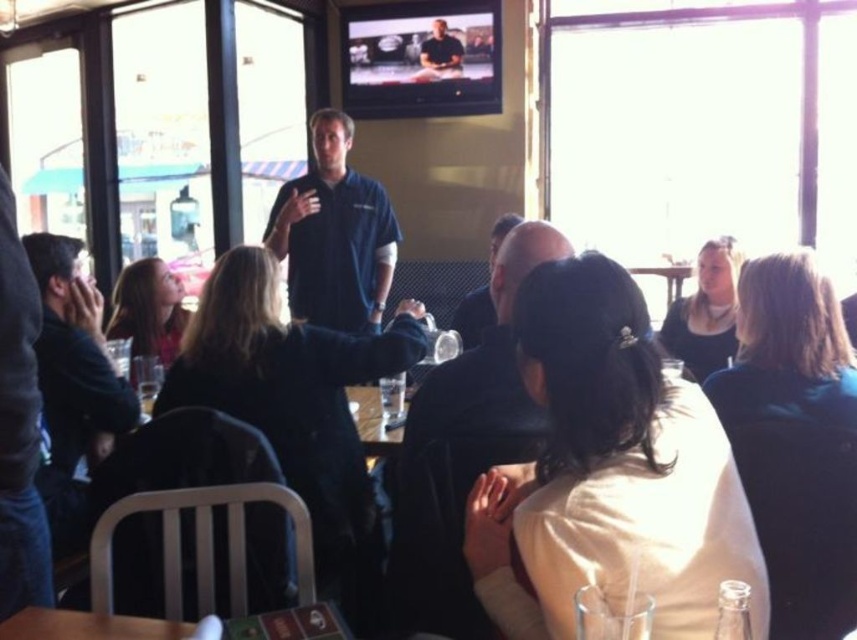
Who is more forward, (544, 616) or (379, 240)?

Point (544, 616)

Can you confirm if white matte shirt at center is shorter than dark blue polo shirt at center?

Indeed, white matte shirt at center has a lesser height compared to dark blue polo shirt at center.

Image resolution: width=857 pixels, height=640 pixels. Describe the element at coordinates (610, 472) in the screenshot. I see `white matte shirt at center` at that location.

I want to click on white matte shirt at center, so click(610, 472).

Does dark blue polo shirt at center appear over dark blue shirt at left?

Yes.

Does dark blue polo shirt at center appear on the left side of dark blue shirt at left?

No, dark blue polo shirt at center is not to the left of dark blue shirt at left.

Is point (291, 289) in front of point (55, 358)?

That is False.

Find the location of `dark blue polo shirt at center`. dark blue polo shirt at center is located at coordinates (334, 234).

Does dark gray shirt at center have a greater width compared to wooden table at center?

Indeed, dark gray shirt at center has a greater width compared to wooden table at center.

Identify the location of dark gray shirt at center. (472, 316).